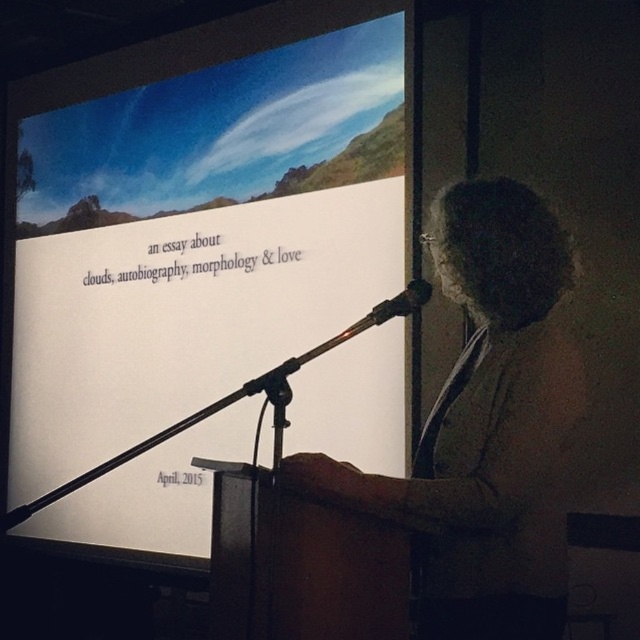
Question: Does white paper at upper center have a lesser width compared to gray fabric at center?

Choices:
 (A) no
 (B) yes

Answer: (A)

Question: Does gray fabric at center appear on the right side of black metallic microphone at center?

Choices:
 (A) no
 (B) yes

Answer: (B)

Question: Which point appears closest to the camera in this image?

Choices:
 (A) (424, 304)
 (B) (557, 576)

Answer: (B)

Question: Based on their relative distances, which object is farther from the black metallic microphone at center?

Choices:
 (A) gray fabric at center
 (B) white paper at upper center

Answer: (B)

Question: Which point is farther to the camera?

Choices:
 (A) (564, 552)
 (B) (230, 269)
 (C) (404, 294)

Answer: (B)

Question: Can you confirm if white paper at upper center is smaller than black metallic microphone at center?

Choices:
 (A) no
 (B) yes

Answer: (A)